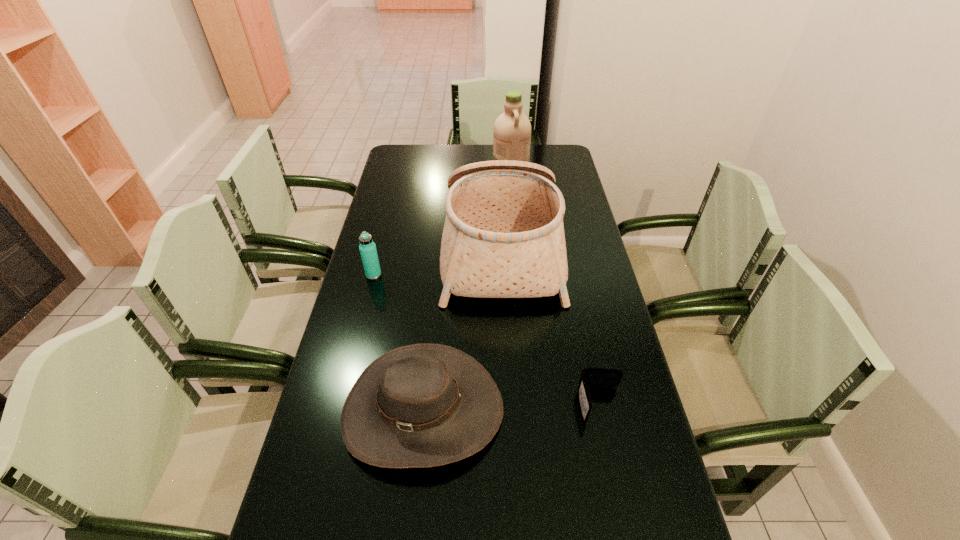
I want to click on basket, so click(x=503, y=237).

Locate an element on the screen. This screenshot has width=960, height=540. cleansing agent is located at coordinates (512, 130).

You are a GUI agent. You are given a task and a screenshot of the screen. Output one action in this format:
    pyautogui.click(x=<x>, y=<y>)
    Task: Click on the water bottle
    Image resolution: width=960 pixels, height=540 pixels.
    Given the screenshot: What is the action you would take?
    pyautogui.click(x=367, y=247)

Where is `cowboy hat`? The width and height of the screenshot is (960, 540). cowboy hat is located at coordinates (424, 405).

Identify the location of the shortest object. This screenshot has height=540, width=960. (590, 377).

The width and height of the screenshot is (960, 540). I want to click on free space located with the lid open on the basket, so 367,249.

The height and width of the screenshot is (540, 960). What are the coordinates of `free space located with the lid open on the basket` in the screenshot? It's located at (429, 249).

Identify the location of vacant region located 0.100m with the lid open on the basket. (414, 249).

Identify the location of vacant space positioned on the front label of the farthest object. 441,161.

You are a GUI agent. You are given a task and a screenshot of the screen. Output one action in this format:
    pyautogui.click(x=<x>, y=<y>)
    Task: Click on the free space located on the front label of the farthest object
    The width and height of the screenshot is (960, 540).
    Given the screenshot: What is the action you would take?
    pyautogui.click(x=426, y=161)